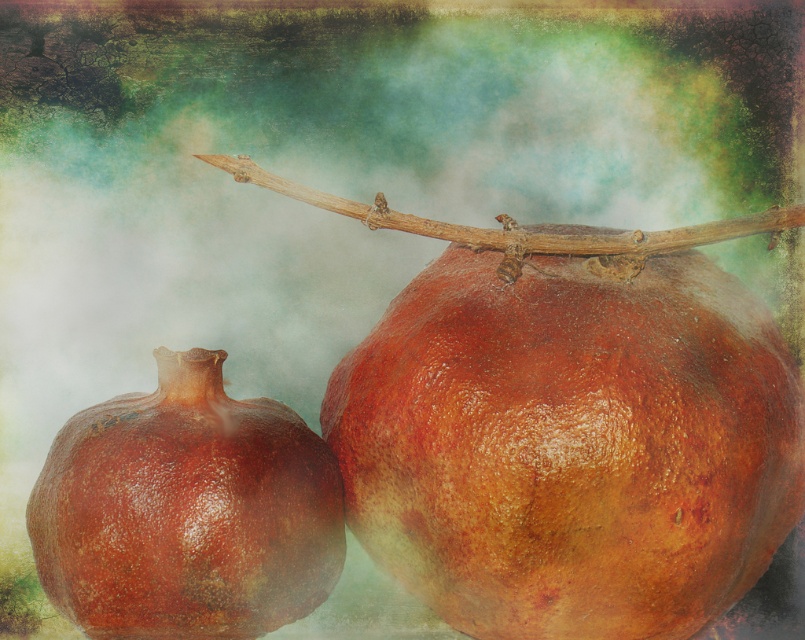
Question: Is glossy brown pomegranate at center thinner than shiny brown pomegranate at center?

Choices:
 (A) no
 (B) yes

Answer: (A)

Question: Which object is closer to the camera taking this photo?

Choices:
 (A) glossy brown pomegranate at center
 (B) brown rough branch at center
 (C) shiny brown pomegranate at center

Answer: (C)

Question: Which is farther from the shiny brown pomegranate at center?

Choices:
 (A) glossy brown pomegranate at center
 (B) brown rough branch at center

Answer: (B)

Question: Can you confirm if glossy brown pomegranate at center is smaller than brown rough branch at center?

Choices:
 (A) no
 (B) yes

Answer: (A)

Question: Which object is farther from the camera taking this photo?

Choices:
 (A) shiny brown pomegranate at center
 (B) brown rough branch at center
 (C) glossy brown pomegranate at center

Answer: (B)

Question: Does glossy brown pomegranate at center come behind shiny brown pomegranate at center?

Choices:
 (A) yes
 (B) no

Answer: (A)